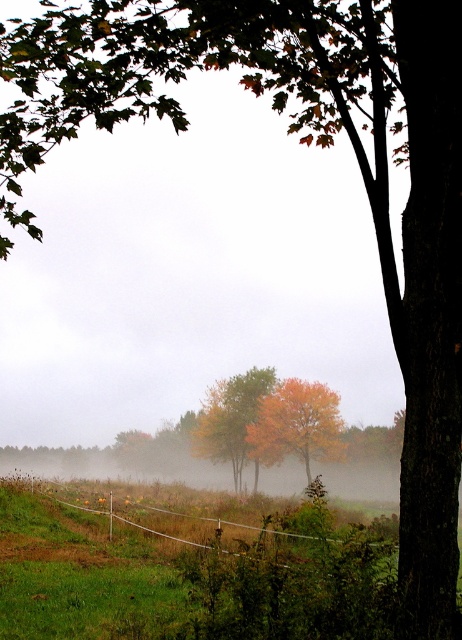
You are a photographer trying to capture the autumn leaves at center in your shot. You notice the green wire fence at lower center is blocking part of the view. Can you estimate if the fence is larger or smaller than the leaves?

The green wire fence at lower center is bigger than autumn leaves at center, so the fence is larger and may obstruct more of the view.